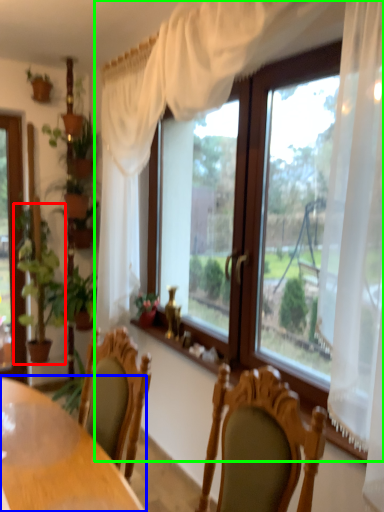
Question: Based on their relative distances, which object is farther from houseplant (highlighted by a red box)? Choose from table (highlighted by a blue box) and window (highlighted by a green box).

Choices:
 (A) table
 (B) window

Answer: (A)